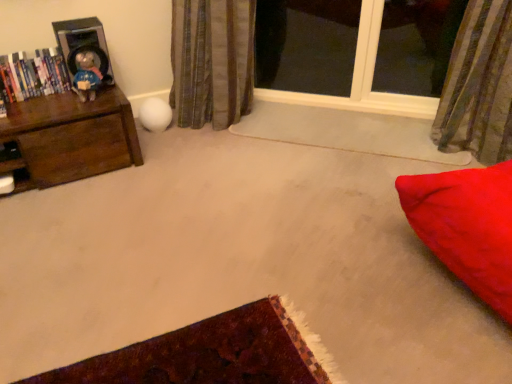
What do you see at coordinates (479, 85) in the screenshot? The width and height of the screenshot is (512, 384). I see `striped fabric curtain at upper right, the 1th curtain positioned from the right` at bounding box center [479, 85].

You are a GUI agent. You are given a task and a screenshot of the screen. Output one action in this format:
    pyautogui.click(x=<x>, y=<y>)
    Task: Click on the metallic silver speaker at upper left
    Image resolution: width=512 pixels, height=384 pixels.
    Given the screenshot: What is the action you would take?
    coord(83,44)

Find the location of `matte plastic doll at left`. matte plastic doll at left is located at coordinates tap(86, 76).

This screenshot has height=384, width=512. I want to click on white fabric curtain at upper left, placed as the second curtain when sorted from right to left, so click(x=212, y=61).

Can you confirm if transparent glass window at upper center is bigger than metallic silver speaker at upper left?

Correct, transparent glass window at upper center is larger in size than metallic silver speaker at upper left.

Can we say transparent glass window at upper center lies outside metallic silver speaker at upper left?

transparent glass window at upper center lies outside metallic silver speaker at upper left's area.

Which object is further away from the camera taking this photo, transparent glass window at upper center or metallic silver speaker at upper left?

transparent glass window at upper center is more distant.

Which object is thinner, brown wood chest of drawers at left or striped fabric curtain at upper right, the 2th curtain in the left-to-right sequence?

striped fabric curtain at upper right, the 2th curtain in the left-to-right sequence.

This screenshot has height=384, width=512. Find the location of `furniture behind the striped fabric curtain at upper right, the 1th curtain positioned from the right`. furniture behind the striped fabric curtain at upper right, the 1th curtain positioned from the right is located at coordinates (69, 138).

Consider the image. From the image's perspective, which is below, brown wood chest of drawers at left or striped fabric curtain at upper right, the 1th curtain positioned from the right?

brown wood chest of drawers at left is shown below in the image.

Who is taller, brown wood chest of drawers at left or striped fabric curtain at upper right, the 1th curtain positioned from the right?

striped fabric curtain at upper right, the 1th curtain positioned from the right.

Is white fabric curtain at upper left, placed as the second curtain when sorted from right to left, not within brown wood chest of drawers at left?

Yes, white fabric curtain at upper left, placed as the second curtain when sorted from right to left, is located beyond the bounds of brown wood chest of drawers at left.

Can you confirm if white fabric curtain at upper left, the 1th curtain viewed from the left, is shorter than brown wood chest of drawers at left?

Incorrect, the height of white fabric curtain at upper left, the 1th curtain viewed from the left, does not fall short of that of brown wood chest of drawers at left.

Consider the image. Is white fabric curtain at upper left, the 1th curtain viewed from the left, at the right side of brown wood chest of drawers at left?

Indeed, white fabric curtain at upper left, the 1th curtain viewed from the left, is positioned on the right side of brown wood chest of drawers at left.

From a real-world perspective, which is physically above, white fabric curtain at upper left, placed as the second curtain when sorted from right to left, or brown wood chest of drawers at left?

From a 3D spatial view, white fabric curtain at upper left, placed as the second curtain when sorted from right to left, is above.

This screenshot has width=512, height=384. I want to click on doll on the left of transparent glass window at upper center, so click(86, 76).

Is matte plastic doll at left not inside transparent glass window at upper center?

matte plastic doll at left lies outside transparent glass window at upper center's area.

Does point (76, 75) come farther from viewer compared to point (365, 27)?

No, (76, 75) is in front of (365, 27).

From the image's perspective, between brown wood chest of drawers at left and hardcover books at left, which one is located above?

From the image's view, hardcover books at left is above.

Is point (15, 114) positioned behind point (8, 54)?

That is False.

Is hardcover books at left positioned behind brown wood chest of drawers at left?

Yes, the depth of hardcover books at left is greater than that of brown wood chest of drawers at left.

Could brown wood chest of drawers at left be considered to be inside hardcover books at left?

Definitely not — brown wood chest of drawers at left is not inside hardcover books at left.

Which object is positioned more to the left, hardcover books at left or matte plastic doll at left?

hardcover books at left is more to the left.

Does hardcover books at left touch matte plastic doll at left?

No, hardcover books at left is not beside matte plastic doll at left.

How many degrees apart are the facing directions of hardcover books at left and matte plastic doll at left?

hardcover books at left and matte plastic doll at left are facing 2.63 degrees away from each other.

The height and width of the screenshot is (384, 512). I want to click on window below the metallic silver speaker at upper left (from a real-world perspective), so click(362, 78).

From the brown wood chest of drawers at left, count 2nd curtain to the right and point to it. Please provide its 2D coordinates.

[(479, 85)]

Consider the image. Considering their positions, is white fabric curtain at upper left, placed as the second curtain when sorted from right to left, positioned further to striped fabric curtain at upper right, the 1th curtain positioned from the right, than metallic silver speaker at upper left?

metallic silver speaker at upper left is further to striped fabric curtain at upper right, the 1th curtain positioned from the right.

Which object lies further to the anchor point striped fabric curtain at upper right, the 2th curtain in the left-to-right sequence, hardcover books at left or metallic silver speaker at upper left?

Based on the image, hardcover books at left appears to be further to striped fabric curtain at upper right, the 2th curtain in the left-to-right sequence.

Estimate the real-world distances between objects in this image. Which object is closer to striped fabric curtain at upper right, the 1th curtain positioned from the right, matte plastic doll at left or white fabric curtain at upper left, placed as the second curtain when sorted from right to left?

Among the two, white fabric curtain at upper left, placed as the second curtain when sorted from right to left, is located nearer to striped fabric curtain at upper right, the 1th curtain positioned from the right.

Looking at the image, which one is located closer to striped fabric curtain at upper right, the 2th curtain in the left-to-right sequence, white fabric curtain at upper left, the 1th curtain viewed from the left, or brown wood chest of drawers at left?

Based on the image, white fabric curtain at upper left, the 1th curtain viewed from the left, appears to be nearer to striped fabric curtain at upper right, the 2th curtain in the left-to-right sequence.

Looking at the image, which one is located closer to metallic silver speaker at upper left, white fabric curtain at upper left, placed as the second curtain when sorted from right to left, or striped fabric curtain at upper right, the 2th curtain in the left-to-right sequence?

white fabric curtain at upper left, placed as the second curtain when sorted from right to left.

Estimate the real-world distances between objects in this image. Which object is further from metallic silver speaker at upper left, brown wood chest of drawers at left or white fabric curtain at upper left, the 1th curtain viewed from the left?

white fabric curtain at upper left, the 1th curtain viewed from the left.

Looking at the image, which one is located further to striped fabric curtain at upper right, the 2th curtain in the left-to-right sequence, brown wood chest of drawers at left or white fabric curtain at upper left, placed as the second curtain when sorted from right to left?

brown wood chest of drawers at left is positioned further to the anchor striped fabric curtain at upper right, the 2th curtain in the left-to-right sequence.

Based on their spatial positions, is hardcover books at left or striped fabric curtain at upper right, the 2th curtain in the left-to-right sequence, further from transparent glass window at upper center?

hardcover books at left is positioned further to the anchor transparent glass window at upper center.

The height and width of the screenshot is (384, 512). In order to click on window situated between hardcover books at left and striped fabric curtain at upper right, the 1th curtain positioned from the right, from left to right in this screenshot , I will do `click(362, 78)`.

You are a GUI agent. You are given a task and a screenshot of the screen. Output one action in this format:
    pyautogui.click(x=<x>, y=<y>)
    Task: Click on the doll between brown wood chest of drawers at left and white fabric curtain at upper left, placed as the second curtain when sorted from right to left, in the horizontal direction
    
    Given the screenshot: What is the action you would take?
    pyautogui.click(x=86, y=76)

The image size is (512, 384). I want to click on book between metallic silver speaker at upper left and brown wood chest of drawers at left in the up-down direction, so click(32, 74).

At what (x,y) coordinates should I click in order to perform the action: click on curtain located between matte plastic doll at left and transparent glass window at upper center in the left-right direction. Please return your answer as a coordinate pair (x, y). This screenshot has width=512, height=384. Looking at the image, I should click on (212, 61).